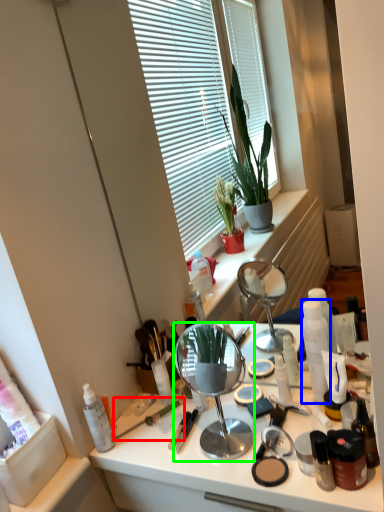
Question: Which object is positioned closest to paint brush (highlighted by a red box)? Select from toiletry (highlighted by a blue box) and mirror (highlighted by a green box).

Choices:
 (A) toiletry
 (B) mirror

Answer: (B)